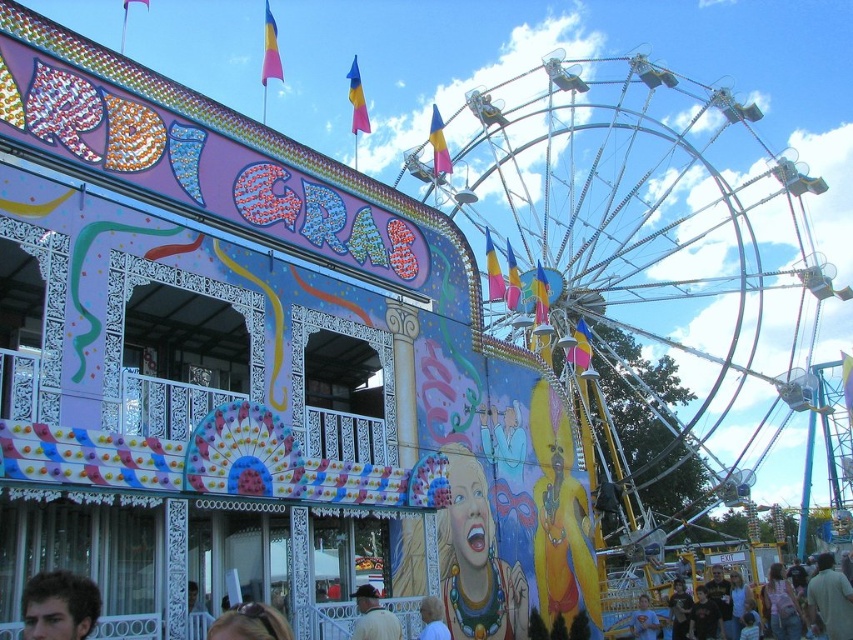
In the scene shown: Does light brown hair at lower right lie in front of brown leather jacket at lower center?

That is False.

What do you see at coordinates (810, 604) in the screenshot?
I see `light brown hair at lower right` at bounding box center [810, 604].

The width and height of the screenshot is (853, 640). I want to click on light brown hair at lower right, so click(x=810, y=604).

Between brown leather jacket at lower center and smooth beige shirt at lower center, which one is positioned higher?

brown leather jacket at lower center is above.

Between brown leather jacket at lower center and smooth beige shirt at lower center, which one is positioned lower?

smooth beige shirt at lower center is below.

Between point (399, 636) and point (422, 636), which one is positioned behind?

Positioned behind is point (422, 636).

Identify the location of brown leather jacket at lower center. Image resolution: width=853 pixels, height=640 pixels. (373, 616).

Between dark brown hair at lower left and brown hair at lower center, which one has less height?

dark brown hair at lower left

Does dark brown hair at lower left have a larger size compared to brown hair at lower center?

No, dark brown hair at lower left is not bigger than brown hair at lower center.

The height and width of the screenshot is (640, 853). Describe the element at coordinates (59, 605) in the screenshot. I see `dark brown hair at lower left` at that location.

I want to click on dark brown hair at lower left, so click(x=59, y=605).